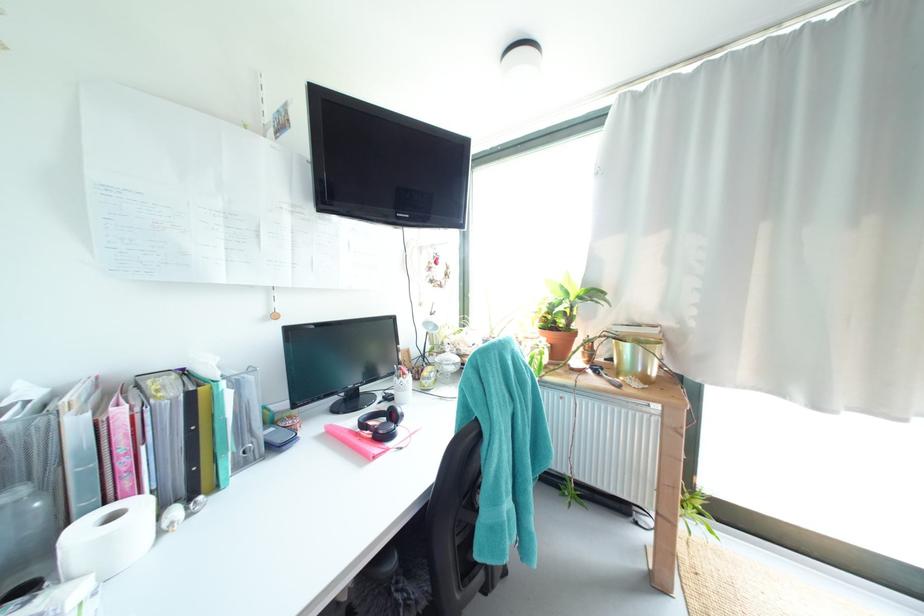
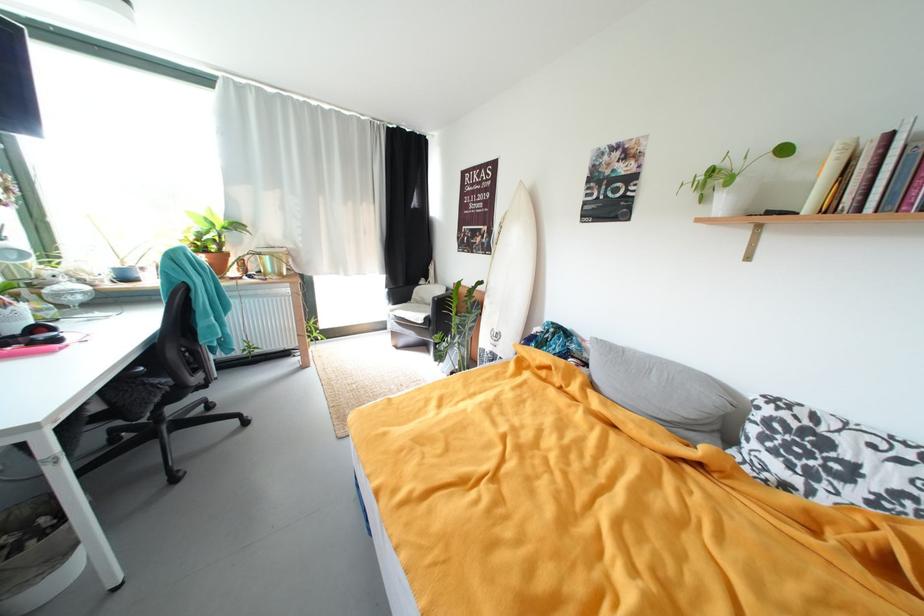
In the second image, find the point that corresponds to (575,294) in the first image.

(221, 225)